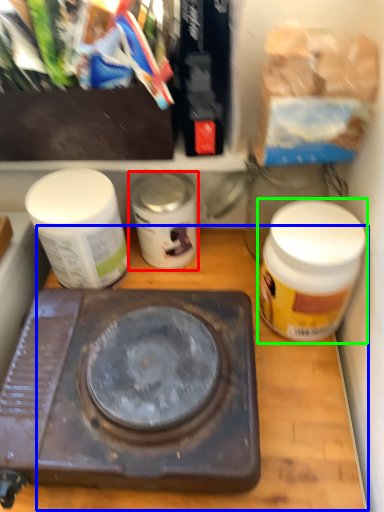
Question: Based on their relative distances, which object is farther from bottle (highlighted by a red box)? Choose from counter top (highlighted by a blue box) and bottle (highlighted by a green box).

Choices:
 (A) counter top
 (B) bottle

Answer: (B)